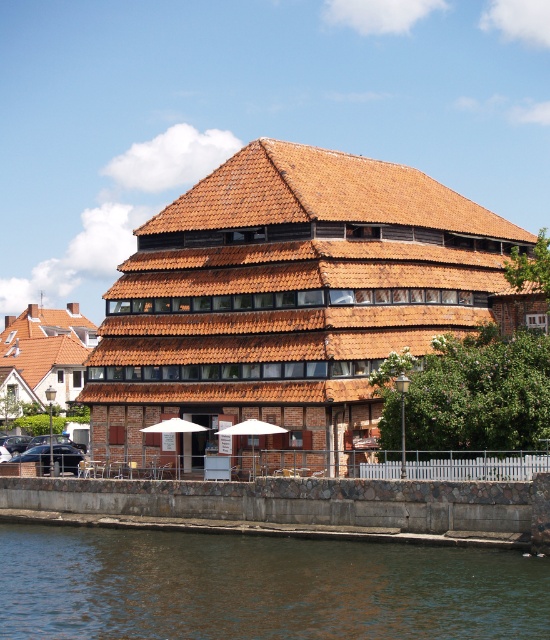
Question: Which of the following is the closest to the observer?

Choices:
 (A) (519, 634)
 (B) (249, 433)

Answer: (A)

Question: Which is nearer to the brown water at lower left?

Choices:
 (A) white fabric umbrella at center
 (B) white matte umbrella at center

Answer: (B)

Question: Is white matte umbrella at center to the right of white fabric umbrella at center from the viewer's perspective?

Choices:
 (A) no
 (B) yes

Answer: (B)

Question: Does brown water at lower left have a greater width compared to white fabric umbrella at center?

Choices:
 (A) no
 (B) yes

Answer: (B)

Question: Is brown water at lower left wider than white fabric umbrella at center?

Choices:
 (A) yes
 (B) no

Answer: (A)

Question: Estimate the real-world distances between objects in this image. Which object is farther from the white matte umbrella at center?

Choices:
 (A) brown water at lower left
 (B) white fabric umbrella at center

Answer: (A)